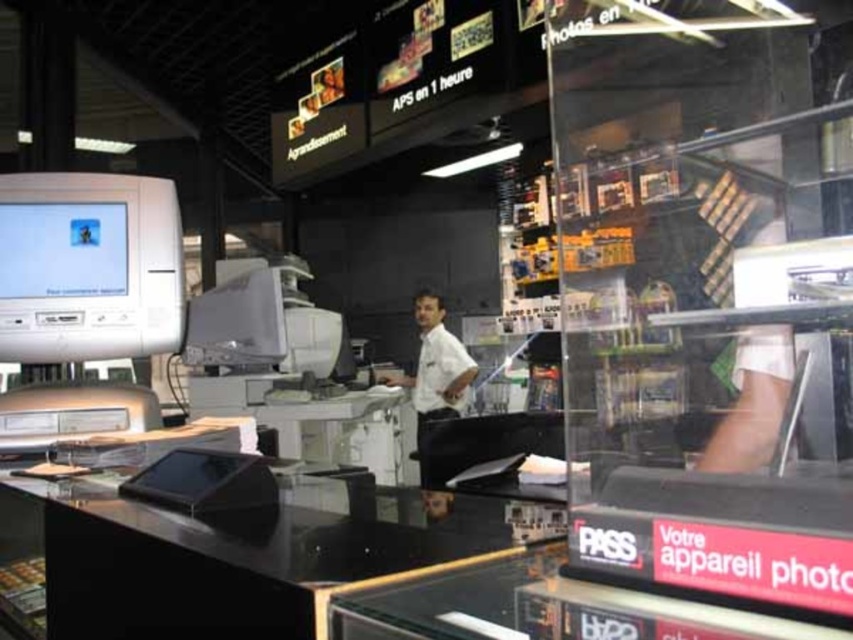
You are a customer in the photo shop and want to ask the person at the counter a question. You see the matte white monitor at upper left and the white shirt at center. Which object should you look towards to get their attention?

You should look towards the white shirt at center to get their attention because the matte white monitor at upper left is to the left of the white shirt at center, indicating the person is facing towards the center area.

You are standing in the photo processing shop and want to determine which of the two points, point (67, 323) or point (204, 337), is closer to you. Based on the scene description, which point is nearer?

Point (67, 323) is closer to the camera than point (204, 337), so it is the nearer point.